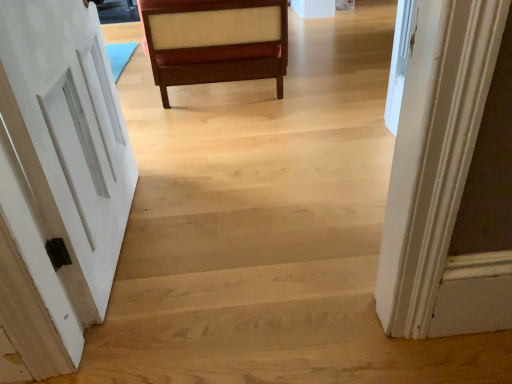
Question: In terms of width, does white painted wood door at left look wider or thinner when compared to mahogany wood chair at center?

Choices:
 (A) thin
 (B) wide

Answer: (A)

Question: Is point (117, 241) positioned closer to the camera than point (160, 97)?

Choices:
 (A) closer
 (B) farther

Answer: (A)

Question: Considering the positions of white painted wood door at left and mahogany wood chair at center in the image, is white painted wood door at left bigger or smaller than mahogany wood chair at center?

Choices:
 (A) small
 (B) big

Answer: (A)

Question: Does point (269, 4) appear closer or farther from the camera than point (15, 105)?

Choices:
 (A) closer
 (B) farther

Answer: (B)

Question: Based on their sizes in the image, would you say mahogany wood chair at center is bigger or smaller than white painted wood door at left?

Choices:
 (A) small
 (B) big

Answer: (B)

Question: From a real-world perspective, relative to white painted wood door at left, is mahogany wood chair at center vertically above or below?

Choices:
 (A) above
 (B) below

Answer: (B)

Question: Is mahogany wood chair at center inside or outside of white painted wood door at left?

Choices:
 (A) inside
 (B) outside

Answer: (B)